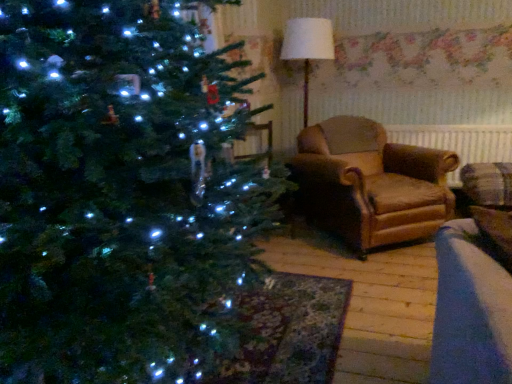
Question: Is white fabric lampshade at upper center outside leather armchair at center?

Choices:
 (A) yes
 (B) no

Answer: (A)

Question: From the image's perspective, is white fabric lampshade at upper center over leather armchair at center?

Choices:
 (A) no
 (B) yes

Answer: (B)

Question: From a real-world perspective, is white fabric lampshade at upper center positioned over leather armchair at center based on gravity?

Choices:
 (A) yes
 (B) no

Answer: (A)

Question: Can you confirm if white fabric lampshade at upper center is positioned to the right of leather armchair at center?

Choices:
 (A) no
 (B) yes

Answer: (A)

Question: Does white fabric lampshade at upper center lie in front of leather armchair at center?

Choices:
 (A) yes
 (B) no

Answer: (B)

Question: Does point (506, 155) appear closer or farther from the camera than point (296, 59)?

Choices:
 (A) farther
 (B) closer

Answer: (B)

Question: Considering the relative positions of brown fabric radiator at right and white fabric lampshade at upper center in the image provided, is brown fabric radiator at right to the left or to the right of white fabric lampshade at upper center?

Choices:
 (A) right
 (B) left

Answer: (A)

Question: In terms of width, does brown fabric radiator at right look wider or thinner when compared to white fabric lampshade at upper center?

Choices:
 (A) thin
 (B) wide

Answer: (A)

Question: From the image's perspective, is brown fabric radiator at right above or below white fabric lampshade at upper center?

Choices:
 (A) below
 (B) above

Answer: (A)

Question: In terms of size, does white fabric lampshade at upper center appear bigger or smaller than brown fabric radiator at right?

Choices:
 (A) small
 (B) big

Answer: (B)

Question: From their relative heights in the image, would you say white fabric lampshade at upper center is taller or shorter than brown fabric radiator at right?

Choices:
 (A) short
 (B) tall

Answer: (B)

Question: From a real-world perspective, is white fabric lampshade at upper center physically located above or below brown fabric radiator at right?

Choices:
 (A) above
 (B) below

Answer: (A)

Question: Is white fabric lampshade at upper center to the left or to the right of brown fabric radiator at right in the image?

Choices:
 (A) right
 (B) left

Answer: (B)

Question: From the image's perspective, is brown fabric radiator at right located above or below leather armchair at center?

Choices:
 (A) below
 (B) above

Answer: (B)

Question: Is point (431, 145) closer or farther from the camera than point (394, 226)?

Choices:
 (A) closer
 (B) farther

Answer: (B)